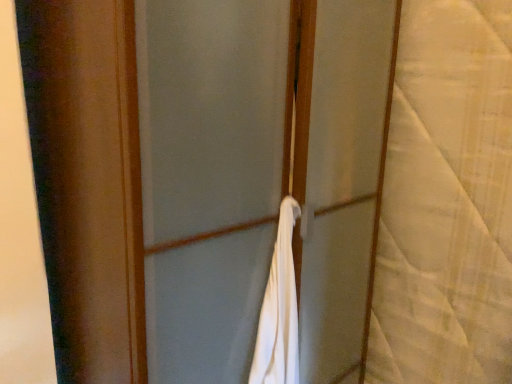
At what (x,y) coordinates should I click in order to perform the action: click on white fabric at center. Please return your answer as a coordinate pair (x, y). Looking at the image, I should click on (260, 175).

What do you see at coordinates (260, 175) in the screenshot?
I see `white fabric at center` at bounding box center [260, 175].

What is the approximate height of white fabric at center?

white fabric at center is 1.62 meters in height.

What do you see at coordinates (447, 201) in the screenshot?
I see `white textured fabric at right` at bounding box center [447, 201].

Where is `white textured fabric at right`? The height and width of the screenshot is (384, 512). white textured fabric at right is located at coordinates (447, 201).

At what (x,y) coordinates should I click in order to perform the action: click on white fabric at center. Please return your answer as a coordinate pair (x, y). This screenshot has height=384, width=512. Looking at the image, I should click on (260, 175).

Is white textured fabric at right at the left side of white fabric at center?

No.

Is white textured fabric at right in front of white fabric at center?

No, white textured fabric at right is behind white fabric at center.

Which is farther from the camera, (440, 269) or (388, 74)?

The point (440, 269) is more distant.

From the image's perspective, between white textured fabric at right and white fabric at center, which one is located above?

white textured fabric at right appears higher in the image.

Looking at this image, from a real-world perspective, which is physically above, white textured fabric at right or white fabric at center?

white textured fabric at right, from a real-world perspective.

Between white textured fabric at right and white fabric at center, which one has smaller width?

Thinner between the two is white textured fabric at right.

Considering the sizes of white textured fabric at right and white fabric at center in the image, is white textured fabric at right taller or shorter than white fabric at center?

white textured fabric at right is shorter than white fabric at center.

Does white textured fabric at right have a larger size compared to white fabric at center?

No.

Is white textured fabric at right spatially inside white fabric at center, or outside of it?

white textured fabric at right is spatially situated outside white fabric at center.

Is white textured fabric at right far away from white fabric at center?

No.

From the picture: Is white textured fabric at right turned away from white fabric at center?

No, white textured fabric at right is not facing the opposite direction of white fabric at center.

What's the angular difference between white textured fabric at right and white fabric at center's facing directions?

The angular difference between white textured fabric at right and white fabric at center is 87.5 degrees.

What are the coordinates of `curtain above the white fabric at center (from a real-world perspective)` in the screenshot? It's located at (447, 201).

Which is more to the right, white fabric at center or white textured fabric at right?

Positioned to the right is white textured fabric at right.

Who is more distant, white fabric at center or white textured fabric at right?

white textured fabric at right is behind.

Which is less distant, [333,123] or [382,369]?

Positioned in front is point [333,123].

From the image's perspective, relative to white textured fabric at right, is white fabric at center above or below?

From the image's perspective, white fabric at center appears below white textured fabric at right.

From a real-world perspective, which is physically below, white fabric at center or white textured fabric at right?

white fabric at center.

Considering the sizes of objects white fabric at center and white textured fabric at right in the image provided, who is thinner, white fabric at center or white textured fabric at right?

white textured fabric at right.

Is white fabric at center taller than white textured fabric at right?

Yes.

From the picture: Can you confirm if white fabric at center is smaller than white textured fabric at right?

Actually, white fabric at center might be larger than white textured fabric at right.

Is white fabric at center situated inside white textured fabric at right or outside?

white fabric at center lies outside white textured fabric at right.

Are white fabric at center and white textured fabric at right beside each other?

There is a gap between white fabric at center and white textured fabric at right.

Is white fabric at center oriented away from white textured fabric at right?

white fabric at center does not have its back to white textured fabric at right.

Looking at this image, how many degrees apart are the facing directions of white fabric at center and white textured fabric at right?

87.5 degrees.

Measure the distance between white fabric at center and white textured fabric at right.

white fabric at center is 39.71 centimeters from white textured fabric at right.

Identify the location of screen door that is on the left side of white textured fabric at right. This screenshot has width=512, height=384. (260, 175).

Where is `curtain that is above the white fabric at center (from the image's perspective)`? curtain that is above the white fabric at center (from the image's perspective) is located at coordinates (447, 201).

In order to click on curtain lying behind the white fabric at center in this screenshot , I will do `click(447, 201)`.